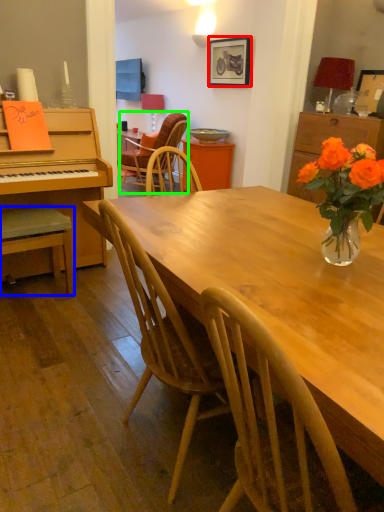
Question: Estimate the real-world distances between objects in this image. Which object is farther from picture frame (highlighted by a red box), chair (highlighted by a blue box) or chair (highlighted by a green box)?

Choices:
 (A) chair
 (B) chair

Answer: (A)